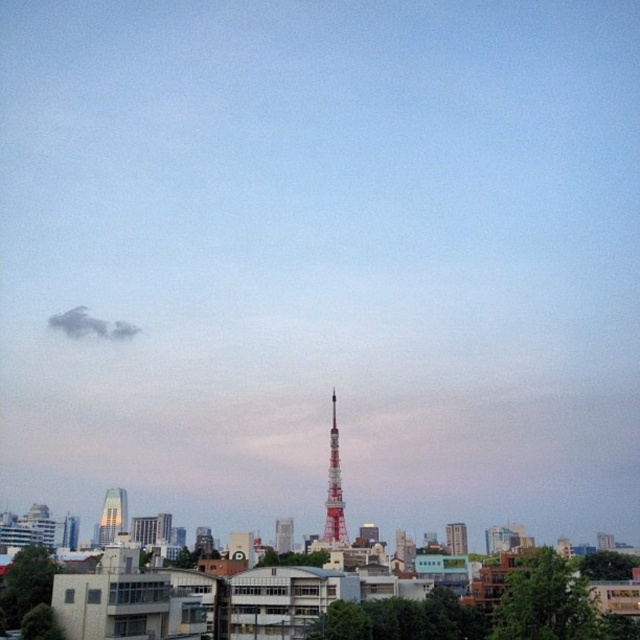
Question: Can you confirm if silver glass skyscraper at lower left is bigger than white glossy tower at center?

Choices:
 (A) yes
 (B) no

Answer: (A)

Question: Can you confirm if red painted metal tower at center is thinner than white glossy tower at center?

Choices:
 (A) yes
 (B) no

Answer: (A)

Question: Is gray cotton cloud at upper left below red metallic tower at center?

Choices:
 (A) no
 (B) yes

Answer: (A)

Question: Which point is closer to the camera?

Choices:
 (A) (99, 532)
 (B) (288, 529)
 (C) (108, 332)

Answer: (B)

Question: Which of the following is the closest to the observer?

Choices:
 (A) (333, 436)
 (B) (280, 548)
 (C) (115, 531)
 (D) (451, 532)

Answer: (A)

Question: Which point is closer to the camera taking this photo?

Choices:
 (A) (282, 536)
 (B) (104, 500)
 (C) (342, 540)
 (D) (458, 547)

Answer: (C)